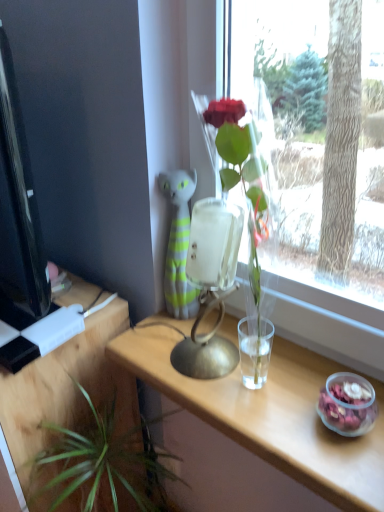
Locate an element on the screen. The width and height of the screenshot is (384, 512). green leafy plant at lower left is located at coordinates (107, 460).

What do you see at coordinates (66, 389) in the screenshot? This screenshot has width=384, height=512. I see `wooden table at lower left, the 2th table when ordered from right to left` at bounding box center [66, 389].

What do you see at coordinates (18, 202) in the screenshot?
I see `black glossy computer monitor at left` at bounding box center [18, 202].

This screenshot has width=384, height=512. I want to click on metallic gold table lamp at center, so click(x=211, y=287).

In terms of height, does green leafy plant at lower left look taller or shorter compared to black glossy computer monitor at left?

green leafy plant at lower left is shorter than black glossy computer monitor at left.

Considering the positions of objects green leafy plant at lower left and black glossy computer monitor at left in the image provided, who is in front, green leafy plant at lower left or black glossy computer monitor at left?

black glossy computer monitor at left is more forward.

In the scene shown: Is there a large distance between green leafy plant at lower left and black glossy computer monitor at left?

No, green leafy plant at lower left is in close proximity to black glossy computer monitor at left.

Does green leafy plant at lower left touch clear wood table at center, the 1th table from the right?

They are not placed beside each other.

Is green leafy plant at lower left aimed at clear wood table at center, the 2th table viewed from the left?

No, green leafy plant at lower left is not oriented towards clear wood table at center, the 2th table viewed from the left.

Looking at their sizes, would you say green leafy plant at lower left is wider or thinner than clear wood table at center, the 2th table viewed from the left?

green leafy plant at lower left is wider than clear wood table at center, the 2th table viewed from the left.

Image resolution: width=384 pixels, height=512 pixels. In order to click on houseplant that appears below the clear wood table at center, the 1th table from the right (from a real-world perspective) in this screenshot , I will do click(x=107, y=460).

Is wooden table at lower left, the 1th table in the left-to-right sequence, taller than green leafy plant at lower left?

Indeed, wooden table at lower left, the 1th table in the left-to-right sequence, has a greater height compared to green leafy plant at lower left.

Which of these two, wooden table at lower left, the 2th table when ordered from right to left, or green leafy plant at lower left, is thinner?

green leafy plant at lower left.

Between wooden table at lower left, the 2th table when ordered from right to left, and green leafy plant at lower left, which one is positioned behind?

wooden table at lower left, the 2th table when ordered from right to left, is further away from the camera.

From a real-world perspective, who is located lower, wooden table at lower left, the 2th table when ordered from right to left, or green leafy plant at lower left?

wooden table at lower left, the 2th table when ordered from right to left, from a real-world perspective.

Is clear wood table at center, the 2th table viewed from the left, aimed at green leafy plant at lower left?

No, clear wood table at center, the 2th table viewed from the left, is not aimed at green leafy plant at lower left.

Is clear wood table at center, the 2th table viewed from the left, far away from green leafy plant at lower left?

No, clear wood table at center, the 2th table viewed from the left, is not far away from green leafy plant at lower left.

Which is in front, clear wood table at center, the 2th table viewed from the left, or green leafy plant at lower left?

Positioned in front is clear wood table at center, the 2th table viewed from the left.

This screenshot has height=512, width=384. In order to click on houseplant that appears on the left of clear wood table at center, the 2th table viewed from the left in this screenshot , I will do `click(107, 460)`.

Is black glossy computer monitor at left inside or outside of green leafy plant at lower left?

black glossy computer monitor at left is spatially situated outside green leafy plant at lower left.

What's the angular difference between black glossy computer monitor at left and green leafy plant at lower left's facing directions?

There is a 0.455-degree angle between the facing directions of black glossy computer monitor at left and green leafy plant at lower left.

Between black glossy computer monitor at left and green leafy plant at lower left, which one appears on the left side from the viewer's perspective?

black glossy computer monitor at left is more to the left.

Looking at this image, how far apart are black glossy computer monitor at left and green leafy plant at lower left?

black glossy computer monitor at left and green leafy plant at lower left are 18.50 inches apart.

Choose the correct answer: Is metallic gold table lamp at center inside black glossy computer monitor at left or outside it?

metallic gold table lamp at center is located beyond the bounds of black glossy computer monitor at left.

From a real-world perspective, is metallic gold table lamp at center physically located above or below black glossy computer monitor at left?

From a real-world perspective, metallic gold table lamp at center is physically below black glossy computer monitor at left.

From the image's perspective, who appears lower, metallic gold table lamp at center or black glossy computer monitor at left?

metallic gold table lamp at center.

Which object is positioned more to the left, metallic gold table lamp at center or black glossy computer monitor at left?

black glossy computer monitor at left.

Does black glossy computer monitor at left come in front of wooden table at lower left, the 1th table in the left-to-right sequence?

Yes, black glossy computer monitor at left is closer to the camera.

Does point (26, 218) come behind point (116, 413)?

No, (26, 218) is in front of (116, 413).

Could you measure the distance between black glossy computer monitor at left and wooden table at lower left, the 1th table in the left-to-right sequence?

They are 11.11 inches apart.

Locate an element on the screen. table on the left of black glossy computer monitor at left is located at coordinates (66, 389).

Where is `computer monitor that is on the left side of green leafy plant at lower left`? This screenshot has height=512, width=384. computer monitor that is on the left side of green leafy plant at lower left is located at coordinates (18, 202).

Locate an element on the screen. houseplant behind the clear wood table at center, the 2th table viewed from the left is located at coordinates (107, 460).

From the picture: Which object lies further to the anchor point metallic gold table lamp at center, green leafy plant at lower left or clear wood table at center, the 2th table viewed from the left?

green leafy plant at lower left lies further to metallic gold table lamp at center than the other object.

Looking at the image, which one is located further to black glossy computer monitor at left, green leafy plant at lower left or clear wood table at center, the 2th table viewed from the left?

clear wood table at center, the 2th table viewed from the left.

From the picture: Looking at the image, which one is located closer to metallic gold table lamp at center, clear wood table at center, the 2th table viewed from the left, or wooden table at lower left, the 2th table when ordered from right to left?

clear wood table at center, the 2th table viewed from the left, is positioned closer to the anchor metallic gold table lamp at center.

Looking at this image, looking at the image, which one is located closer to metallic gold table lamp at center, wooden table at lower left, the 2th table when ordered from right to left, or clear wood table at center, the 2th table viewed from the left?

clear wood table at center, the 2th table viewed from the left.

When comparing their distances from green leafy plant at lower left, does black glossy computer monitor at left or clear wood table at center, the 1th table from the right, seem further?

black glossy computer monitor at left is positioned further to the anchor green leafy plant at lower left.

From the image, which object appears to be nearer to wooden table at lower left, the 1th table in the left-to-right sequence, black glossy computer monitor at left or green leafy plant at lower left?

Among the two, green leafy plant at lower left is located nearer to wooden table at lower left, the 1th table in the left-to-right sequence.

Which object lies nearer to the anchor point metallic gold table lamp at center, wooden table at lower left, the 2th table when ordered from right to left, or green leafy plant at lower left?

Based on the image, wooden table at lower left, the 2th table when ordered from right to left, appears to be nearer to metallic gold table lamp at center.

In the scene shown: Based on their spatial positions, is wooden table at lower left, the 1th table in the left-to-right sequence, or clear wood table at center, the 2th table viewed from the left, closer to black glossy computer monitor at left?

wooden table at lower left, the 1th table in the left-to-right sequence, is positioned closer to the anchor black glossy computer monitor at left.

At what (x,y) coordinates should I click in order to perform the action: click on table lamp between black glossy computer monitor at left and green leafy plant at lower left in the up-down direction. Please return your answer as a coordinate pair (x, y). Image resolution: width=384 pixels, height=512 pixels. Looking at the image, I should click on (211, 287).

Identify the location of table lamp between black glossy computer monitor at left and clear wood table at center, the 1th table from the right, from left to right. (211, 287).

Where is `houseplant between wooden table at lower left, the 2th table when ordered from right to left, and metallic gold table lamp at center, in the horizontal direction`? Image resolution: width=384 pixels, height=512 pixels. houseplant between wooden table at lower left, the 2th table when ordered from right to left, and metallic gold table lamp at center, in the horizontal direction is located at coordinates (107, 460).

Find the location of a particular element. The image size is (384, 512). table lamp between wooden table at lower left, the 1th table in the left-to-right sequence, and clear wood table at center, the 2th table viewed from the left is located at coordinates (211, 287).